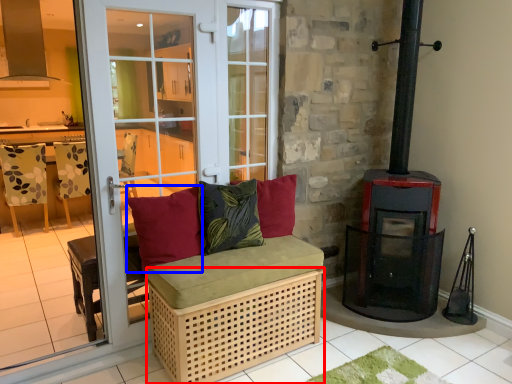
Question: Which object appears farthest to the camera in this image, crate (highlighted by a red box) or pillow (highlighted by a blue box)?

Choices:
 (A) crate
 (B) pillow

Answer: (B)